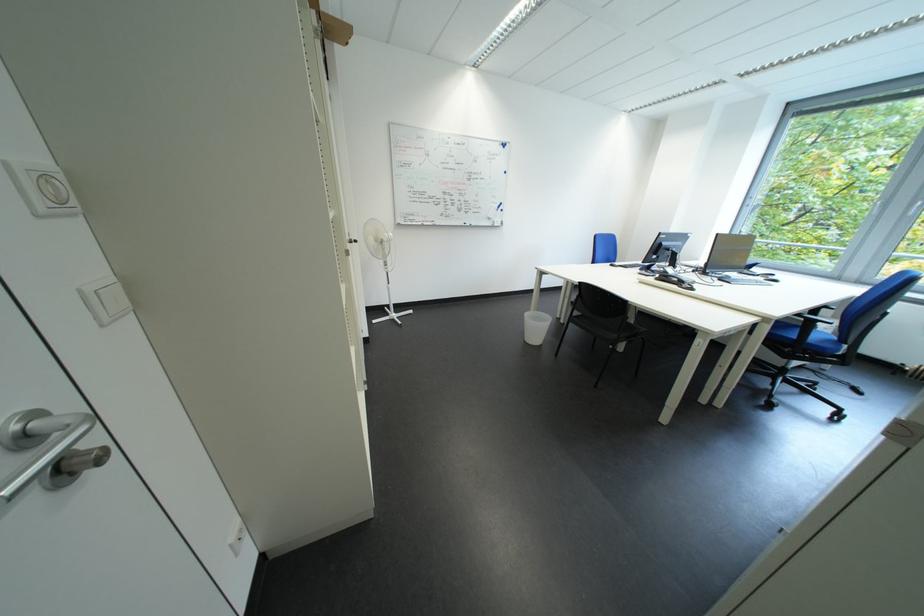
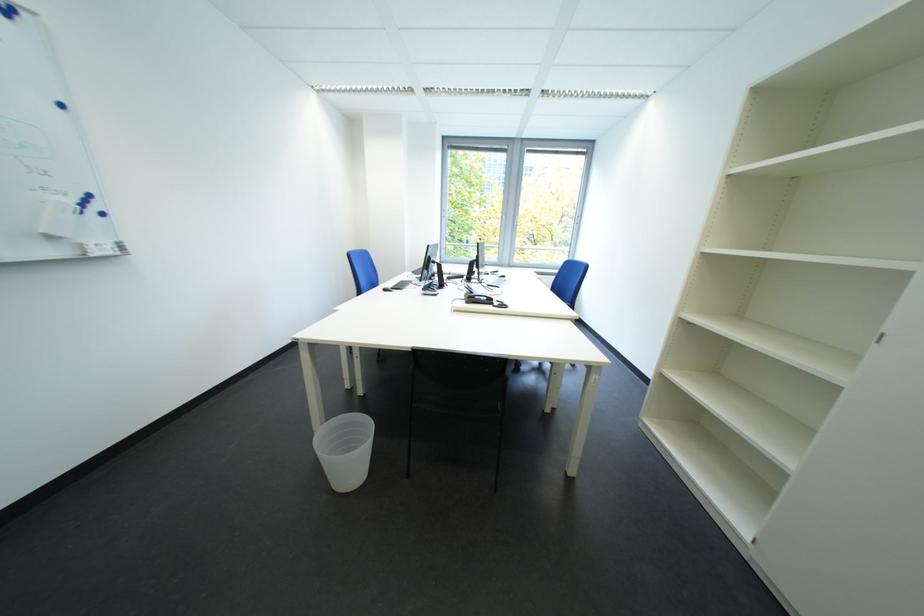
The point at (550, 330) is marked in the first image. Where is the corresponding point in the second image?

(362, 455)